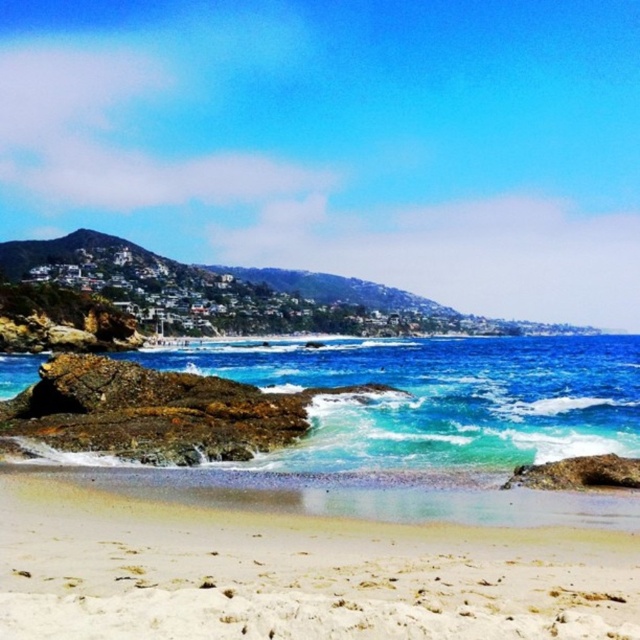
From the picture: You are a beachgoer planning to set up a beach umbrella. You have two options for placement based on the objects in the image. The first option is near the smooth beige sand at lower center, and the second is near the blue translucent water at center. Considering the size of these areas, which location would provide more space for your umbrella and why?

The blue translucent water at center is larger than the smooth beige sand at lower center, so placing the umbrella near the blue translucent water at center would provide more space.

You are standing on the beach in the coastal scene. You see two points marked in the image. The first point is at coordinate point [120,616] and the second is at point [422,468]. Which point is closer to you?

Point [120,616] is closer to the camera than point [422,468], so the first point is closer to you.

You are standing on the smooth beige sand at lower center and want to reach the blue translucent water at center. Which direction should you move to get there?

Since the smooth beige sand at lower center has a lesser height compared to the blue translucent water at center, you should move upward to reach the blue translucent water at center from the lower elevation of the smooth beige sand at lower center.